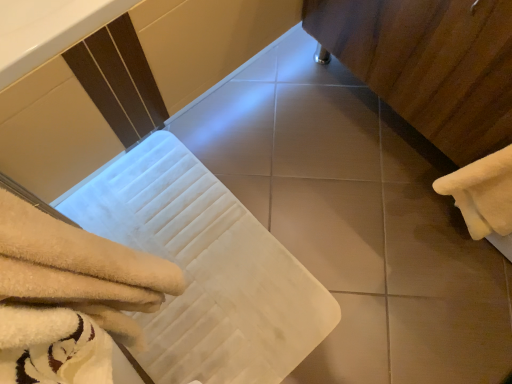
Question: Considering their positions, is white fluffy towel at lower left, arranged as the first towel when viewed from the left, located in front of or behind wooden cabinet at right?

Choices:
 (A) front
 (B) behind

Answer: (A)

Question: Visually, is white fluffy towel at lower left, arranged as the first towel when viewed from the left, positioned to the left or to the right of wooden cabinet at right?

Choices:
 (A) right
 (B) left

Answer: (B)

Question: Which of these objects is positioned closest to the white soft towel at lower left?

Choices:
 (A) wooden cabinet at right
 (B) white fluffy towel at right, the 2th towel positioned from the left
 (C) smooth beige tile at center
 (D) white fluffy towel at lower left, arranged as the first towel when viewed from the left

Answer: (C)

Question: Which object is the farthest from the white fluffy towel at lower left, arranged as the second towel when viewed from the right?

Choices:
 (A) white soft towel at lower left
 (B) wooden cabinet at right
 (C) white fluffy towel at right, which ranks as the first towel in right-to-left order
 (D) smooth beige tile at center

Answer: (B)